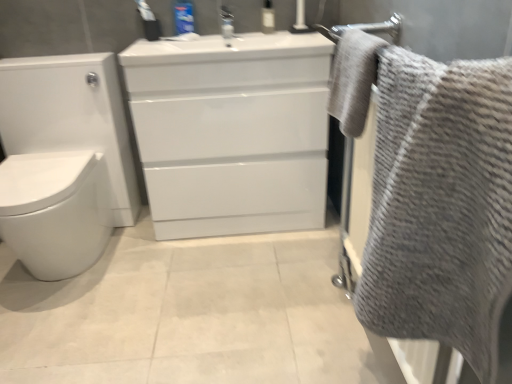
Find the location of a particular element. vacant space that is to the left of transparent plastic bottle at upper center, the second toiletry positioned from the left is located at coordinates (242, 32).